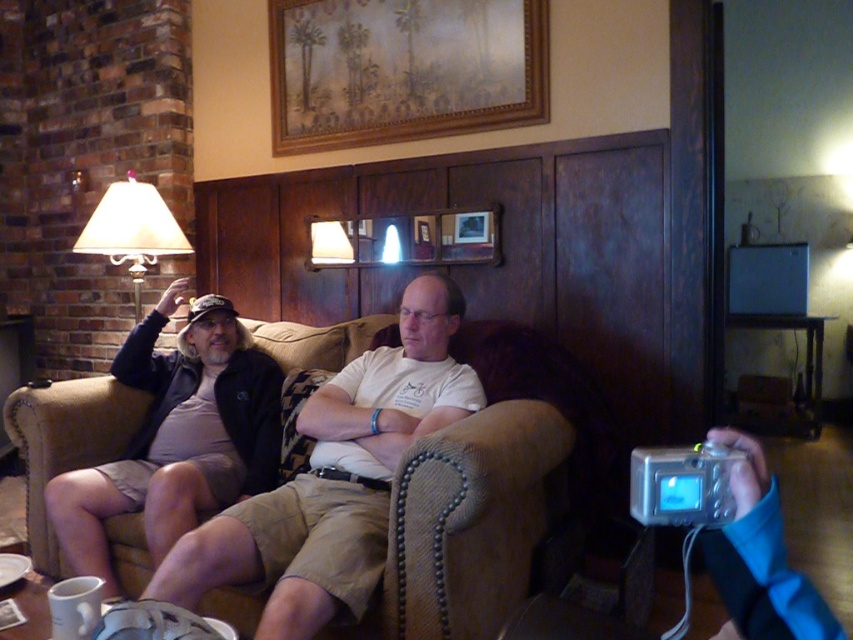
Question: Can you confirm if suede couch at center is positioned above matte black jacket at left?

Choices:
 (A) yes
 (B) no

Answer: (B)

Question: Estimate the real-world distances between objects in this image. Which object is farther from the matte black jacket at left?

Choices:
 (A) matte beige lampshade at left
 (B) suede couch at center

Answer: (B)

Question: Can you confirm if matte black jacket at left is positioned to the left of matte beige lampshade at left?

Choices:
 (A) yes
 (B) no

Answer: (B)

Question: From the image, what is the correct spatial relationship of matte black jacket at left in relation to matte beige lampshade at left?

Choices:
 (A) left
 (B) right

Answer: (B)

Question: Considering the real-world distances, which object is closest to the matte beige lampshade at left?

Choices:
 (A) suede couch at center
 (B) matte black jacket at left

Answer: (B)

Question: Which of these objects is positioned closest to the matte beige lampshade at left?

Choices:
 (A) matte black jacket at left
 (B) suede couch at center

Answer: (A)